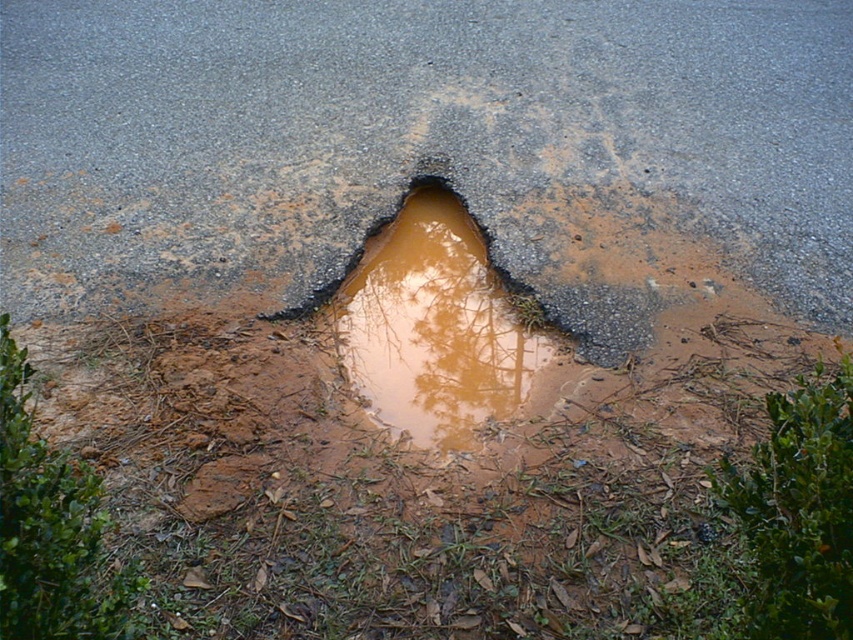
Question: Which point is closer to the camera?

Choices:
 (A) green leafy bush at lower right
 (B) green leafy tree at lower left

Answer: (B)

Question: Can you confirm if green leafy bush at lower right is positioned to the right of green leafy tree at lower left?

Choices:
 (A) yes
 (B) no

Answer: (A)

Question: Does green leafy bush at lower right appear on the left side of green leafy tree at lower left?

Choices:
 (A) no
 (B) yes

Answer: (A)

Question: Can you confirm if green leafy bush at lower right is positioned to the left of green leafy tree at lower left?

Choices:
 (A) yes
 (B) no

Answer: (B)

Question: Which point is farther to the camera?

Choices:
 (A) (827, 568)
 (B) (27, 524)

Answer: (B)